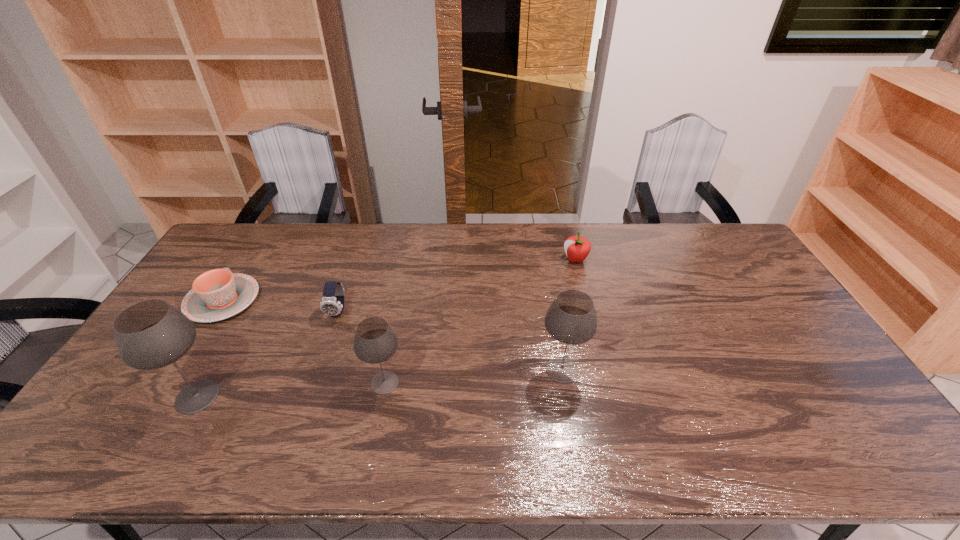
This screenshot has height=540, width=960. Identify the location of object that is positioned at the near left corner. (151, 334).

In the image, there is a desktop. In order to click on blank space at the far edge in this screenshot , I will do pos(597,226).

Find the location of a particular element. blank space at the near edge of the desktop is located at coordinates (667, 403).

Identify the location of free spot at the right edge of the desktop. (829, 366).

The height and width of the screenshot is (540, 960). Identify the location of vacant space at the far left corner of the desktop. (222, 248).

This screenshot has width=960, height=540. Find the location of `free space at the near left corner`. free space at the near left corner is located at coordinates (146, 401).

In the image, there is a desktop. At what (x,y) coordinates should I click in order to perform the action: click on vacant region at the far right corner. Please return your answer as a coordinate pair (x, y). This screenshot has width=960, height=540. Looking at the image, I should click on (710, 242).

Where is `unoccupied area between the rightmost object and the shortest wineglass`? unoccupied area between the rightmost object and the shortest wineglass is located at coordinates (480, 321).

The image size is (960, 540). I want to click on blank region between the chinaware and the leftmost wineglass, so click(210, 349).

Where is `vacant area that lies between the shortest object and the watch`? Image resolution: width=960 pixels, height=540 pixels. vacant area that lies between the shortest object and the watch is located at coordinates (280, 306).